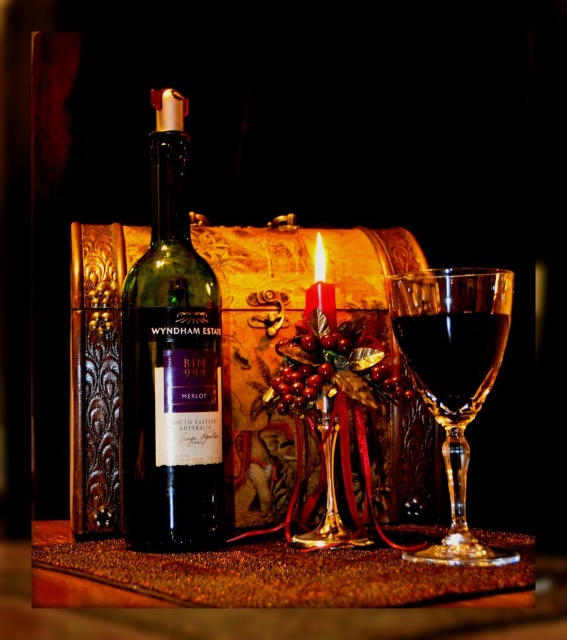
You are setting up a table for a dinner party and have a green glass bottle at center and a transparent glass at right. If you want to place a decorative item between them, which object should you consider for the space between them based on their widths?

The green glass bottle at center has a lesser width compared to transparent glass at right, so the space between them can accommodate a decorative item that is narrower than the transparent glass at right but wider than the green glass bottle at center.

You are standing in front of the still life arrangement and want to place a small decoration between the two points marked as point (145,474) and point (411,332). Which point is closer to you where you should start placing the decoration?

Point (145,474) is closer to you than point (411,332), so you should start placing the decoration near point (145,474).

You are arranging a dinner party and need to place a centerpiece on the shiny brown table at center. However, you also want to ensure the matte red candle at center is visible from above. Is the current arrangement allowing the candle to be seen from above the table?

The shiny brown table at center is below the matte red candle at center, so yes, the candle is visible from above the table.